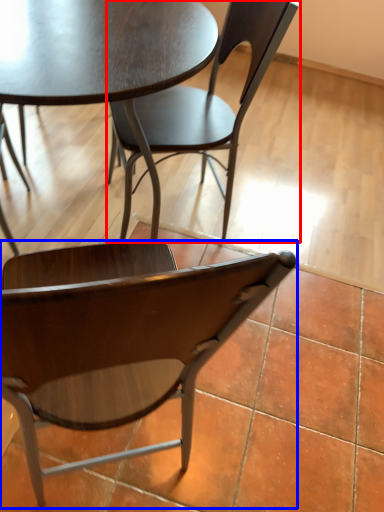
Question: Which point is further to the camera, chair (highlighted by a red box) or chair (highlighted by a blue box)?

Choices:
 (A) chair
 (B) chair

Answer: (A)